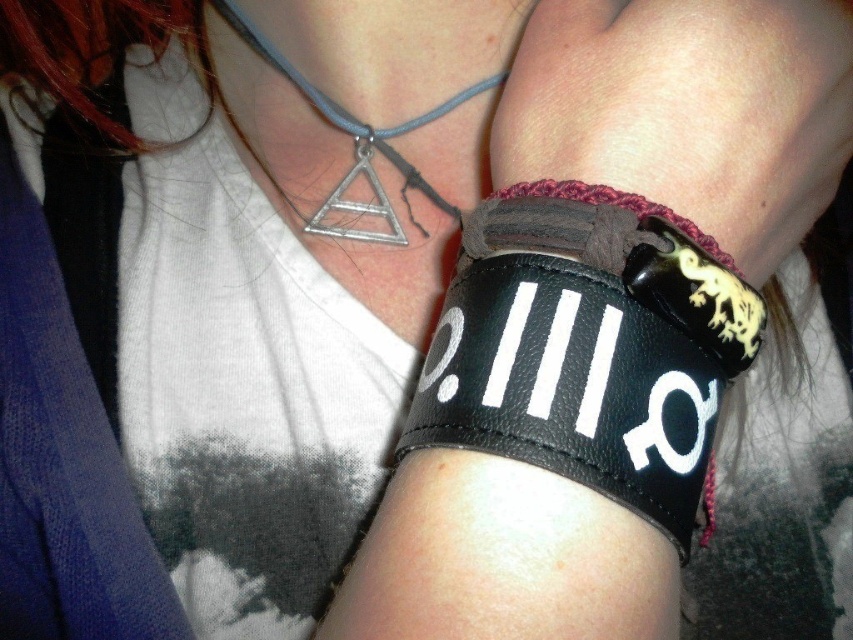
Identify the location of black leather bracelet at right. This screenshot has height=640, width=853. (688, 109).

Is black leather bracelet at right bigger than silver metallic triangle at upper center?

Yes, black leather bracelet at right is bigger than silver metallic triangle at upper center.

At what (x,y) coordinates should I click in order to perform the action: click on black leather bracelet at right. Please return your answer as a coordinate pair (x, y). The height and width of the screenshot is (640, 853). Looking at the image, I should click on (688, 109).